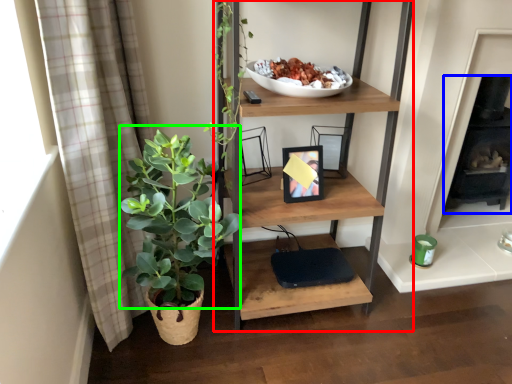
Question: Which object is positioned farthest from shelf (highlighted by a red box)? Select from fireplace (highlighted by a blue box) and vegetation (highlighted by a green box).

Choices:
 (A) fireplace
 (B) vegetation

Answer: (A)